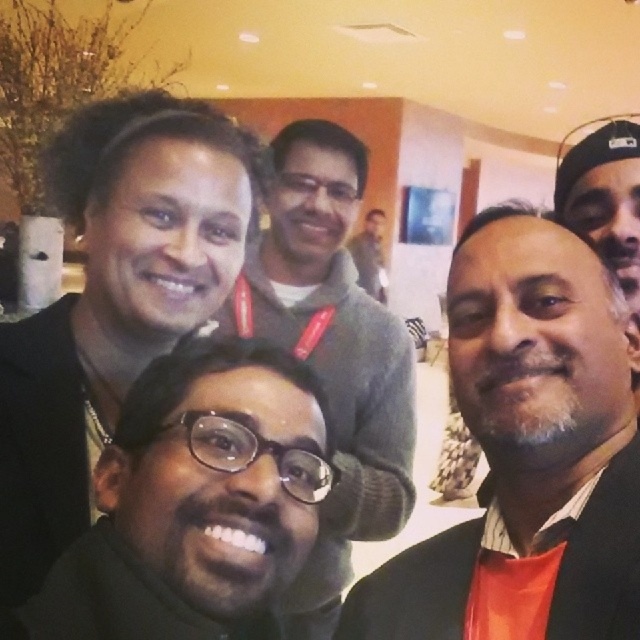
Question: Which of these objects is positioned closest to the black matte face at left?

Choices:
 (A) black matte glasses at center
 (B) matte black sweater at center

Answer: (A)

Question: Based on their relative distances, which object is farther from the matte gray sweater at center?

Choices:
 (A) black matte glasses at center
 (B) matte black sweater at center
 (C) black matte face at left

Answer: (A)

Question: Observing the image, what is the correct spatial positioning of matte black sweater at center in reference to black matte glasses at center?

Choices:
 (A) below
 (B) above

Answer: (B)

Question: Based on their relative distances, which object is farther from the matte gray sweater at center?

Choices:
 (A) matte black sweater at center
 (B) black matte glasses at center
 (C) black matte face at left

Answer: (B)

Question: Is black matte face at left positioned before matte gray sweater at center?

Choices:
 (A) yes
 (B) no

Answer: (A)

Question: Considering the relative positions of matte black sweater at center and black matte glasses at center in the image provided, where is matte black sweater at center located with respect to black matte glasses at center?

Choices:
 (A) right
 (B) left

Answer: (A)